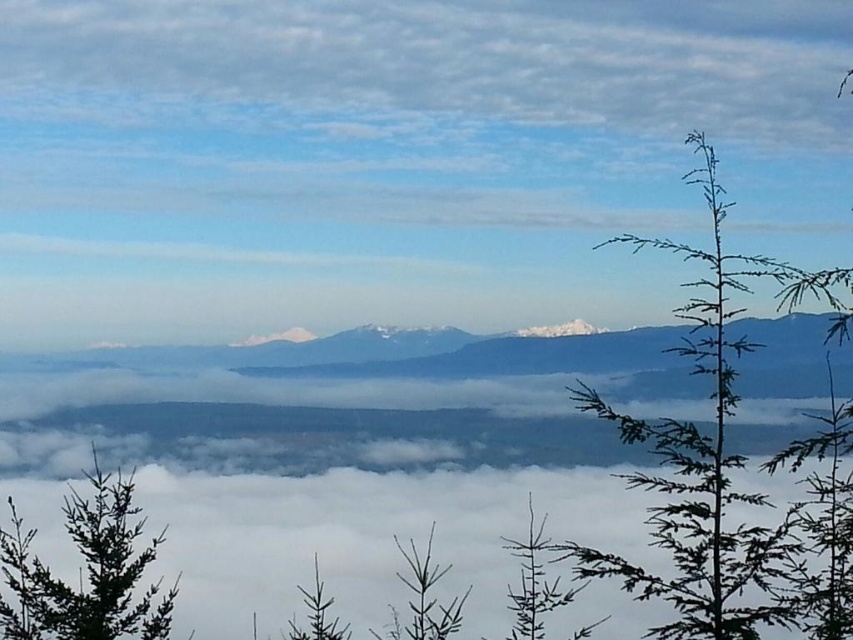
Question: Among these objects, which one is farthest from the camera?

Choices:
 (A) green matte tree at center
 (B) green needle-like tree at right

Answer: (B)

Question: Which point is farther to the camera?

Choices:
 (A) (56, 620)
 (B) (405, 572)

Answer: (A)

Question: Can you confirm if green needle-like tree at right is positioned to the left of green matte tree at lower left?

Choices:
 (A) yes
 (B) no

Answer: (B)

Question: Does green matte tree at lower left appear over green matte tree at center?

Choices:
 (A) no
 (B) yes

Answer: (B)

Question: Estimate the real-world distances between objects in this image. Which object is farther from the green matte tree at lower center?

Choices:
 (A) green matte tree at center
 (B) green matte tree at lower left
 (C) green needle-like tree at right

Answer: (C)

Question: Can you confirm if green needle-like tree at right is positioned to the right of green matte tree at lower center?

Choices:
 (A) no
 (B) yes

Answer: (B)